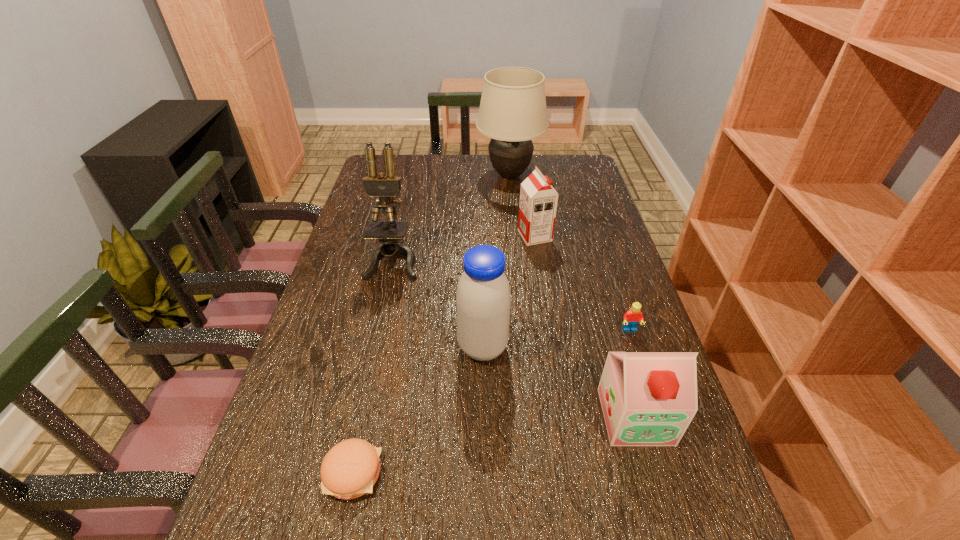
You are a GUI agent. You are given a task and a screenshot of the screen. Output one action in this format:
    pyautogui.click(x=<x>, y=<y>)
    Task: Click on the free space located 0.070m on the left of the tallest soya milk
    
    Given the screenshot: What is the action you would take?
    pyautogui.click(x=429, y=348)

The width and height of the screenshot is (960, 540). Find the location of `vacant space located on the front of the farthest soya milk`. vacant space located on the front of the farthest soya milk is located at coordinates (552, 349).

Locate an element on the screen. Image resolution: width=960 pixels, height=540 pixels. free spot located 0.120m with the cap open on the nearest soya milk is located at coordinates (662, 510).

The image size is (960, 540). In order to click on free space located on the face of the second shortest object in this screenshot , I will do `click(675, 466)`.

Locate an element on the screen. Image resolution: width=960 pixels, height=540 pixels. free space located 0.170m on the right of the patty is located at coordinates (471, 472).

The height and width of the screenshot is (540, 960). I want to click on object situated at the far edge, so click(512, 112).

Find the location of a particular element. Image resolution: width=960 pixels, height=540 pixels. microscope that is at the left edge is located at coordinates (386, 186).

Locate an element on the screen. patty located at the left edge is located at coordinates (350, 469).

Identify the location of soya milk located in the right edge section of the desktop. This screenshot has width=960, height=540. (648, 398).

You are a GUI agent. You are given a task and a screenshot of the screen. Output one action in this format:
    pyautogui.click(x=<x>, y=<y>)
    Task: Click on the Lego positioned at the right edge
    
    Given the screenshot: What is the action you would take?
    pyautogui.click(x=632, y=317)